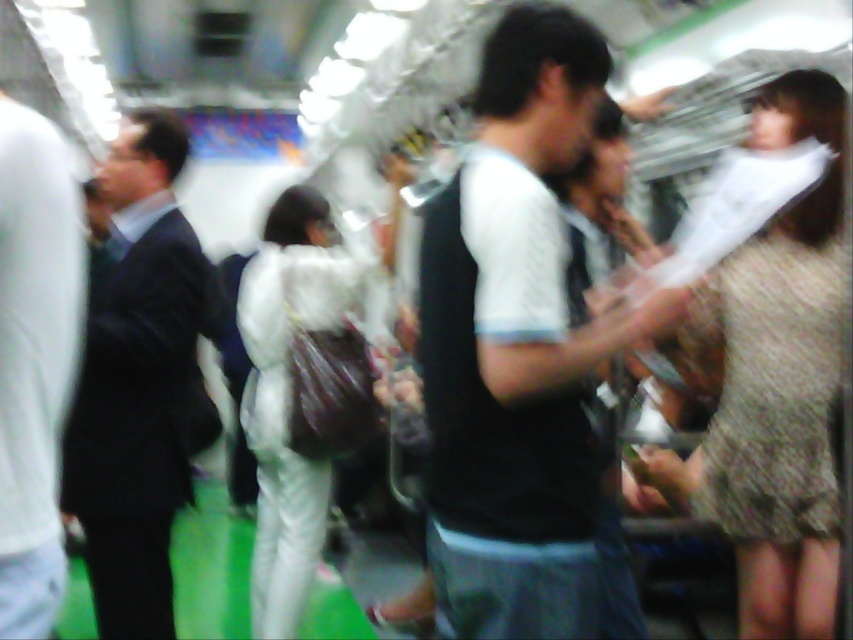
Question: Which object is the farthest from the black matte vest at center?

Choices:
 (A) white matte suit at center
 (B) dark suit at left
 (C) dark gray suit at left

Answer: (A)

Question: Can you confirm if dark suit at left is smaller than white matte suit at center?

Choices:
 (A) no
 (B) yes

Answer: (B)

Question: Which point is closer to the camera taking this photo?

Choices:
 (A) (39, 144)
 (B) (107, 518)

Answer: (A)

Question: Among these points, which one is nearest to the camera?

Choices:
 (A) (465, 561)
 (B) (285, 262)

Answer: (A)

Question: Is the position of black matte vest at center less distant than that of dark suit at left?

Choices:
 (A) yes
 (B) no

Answer: (A)

Question: In this image, where is dark suit at left located relative to dark gray suit at left?

Choices:
 (A) below
 (B) above

Answer: (A)